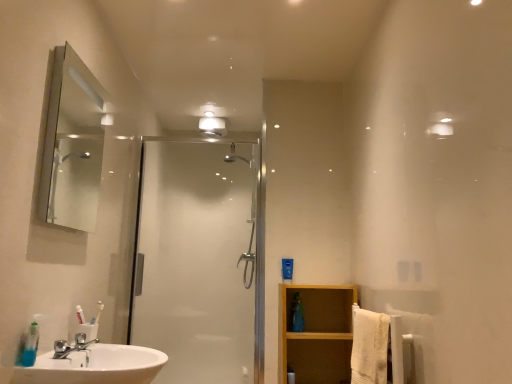
The width and height of the screenshot is (512, 384). What do you see at coordinates (317, 333) in the screenshot?
I see `wooden shelf at lower right` at bounding box center [317, 333].

Where is `white textured towel at right`? white textured towel at right is located at coordinates (369, 347).

Measure the distance between point (211,117) and camera.

They are 3.16 meters apart.

In order to click on clear glass shower door at center in this screenshot , I will do `click(196, 260)`.

Who is taller, wooden shelf at lower right or matte silver mirror at upper left?

With more height is matte silver mirror at upper left.

From the image's perspective, does wooden shelf at lower right appear lower than matte silver mirror at upper left?

Yes, from the image's perspective, wooden shelf at lower right is below matte silver mirror at upper left.

In the image, is wooden shelf at lower right on the left side or the right side of matte silver mirror at upper left?

Clearly, wooden shelf at lower right is on the right of matte silver mirror at upper left in the image.

Considering the sizes of objects wooden shelf at lower right and matte silver mirror at upper left in the image provided, who is wider, wooden shelf at lower right or matte silver mirror at upper left?

wooden shelf at lower right is wider.

This screenshot has width=512, height=384. I want to click on mirror above the clear glass shower door at center (from the image's perspective), so click(72, 145).

Considering the sizes of matte silver mirror at upper left and clear glass shower door at center in the image, is matte silver mirror at upper left bigger or smaller than clear glass shower door at center?

In the image, matte silver mirror at upper left appears to be smaller than clear glass shower door at center.

In the scene shown: Choose the correct answer: Is matte silver mirror at upper left inside clear glass shower door at center or outside it?

matte silver mirror at upper left is located beyond the bounds of clear glass shower door at center.

Considering the relative sizes of matte silver mirror at upper left and clear glass shower door at center in the image provided, is matte silver mirror at upper left shorter than clear glass shower door at center?

Yes, matte silver mirror at upper left is shorter than clear glass shower door at center.

Does point (319, 371) lie behind point (189, 264)?

No, it is in front of (189, 264).

Based on the photo, considering the relative sizes of wooden shelf at lower right and clear glass shower door at center in the image provided, is wooden shelf at lower right shorter than clear glass shower door at center?

Yes, wooden shelf at lower right is shorter than clear glass shower door at center.

Based on the photo, would you say wooden shelf at lower right is to the left or to the right of clear glass shower door at center in the picture?

wooden shelf at lower right is to the right of clear glass shower door at center.

Is wooden shelf at lower right placed right next to white textured towel at right?

No, wooden shelf at lower right is not touching white textured towel at right.

In order to click on bath towel located above the wooden shelf at lower right (from a real-world perspective) in this screenshot , I will do `click(369, 347)`.

Does white textured towel at right have a lesser width compared to wooden shelf at lower right?

Indeed, white textured towel at right has a lesser width compared to wooden shelf at lower right.

Does white textured towel at right have a lesser height compared to wooden shelf at lower right?

Correct, white textured towel at right is not as tall as wooden shelf at lower right.

Is white textured towel at right positioned with its back to wooden shelf at lower right?

white textured towel at right is not turned away from wooden shelf at lower right.

How many degrees apart are the facing directions of white textured towel at right and wooden shelf at lower right?

87.5 degrees.

At what (x,y) coordinates should I click in order to perform the action: click on light fixture that appears above the wooden shelf at lower right (from the image's perspective). Please return your answer as a coordinate pair (x, y). Image resolution: width=512 pixels, height=384 pixels. Looking at the image, I should click on (212, 125).

Considering the sizes of wooden shelf at lower right and white glossy light fixture at upper center in the image, is wooden shelf at lower right taller or shorter than white glossy light fixture at upper center?

Clearly, wooden shelf at lower right is taller compared to white glossy light fixture at upper center.

Is wooden shelf at lower right oriented away from white glossy light fixture at upper center?

No, wooden shelf at lower right is not facing the opposite direction of white glossy light fixture at upper center.

Is wooden shelf at lower right at the left side of white glossy light fixture at upper center?

No, wooden shelf at lower right is not to the left of white glossy light fixture at upper center.

Looking at this image, from the image's perspective, is matte silver mirror at upper left positioned above or below white textured towel at right?

Clearly, from the image's perspective, matte silver mirror at upper left is above white textured towel at right.

Is matte silver mirror at upper left oriented towards white textured towel at right?

Yes, matte silver mirror at upper left faces towards white textured towel at right.

Consider the image. Considering the relative positions of matte silver mirror at upper left and white textured towel at right in the image provided, is matte silver mirror at upper left to the left of white textured towel at right from the viewer's perspective?

Yes, matte silver mirror at upper left is to the left of white textured towel at right.

Is matte silver mirror at upper left spatially inside white textured towel at right, or outside of it?

The correct answer is: outside.

At what (x,y) coordinates should I click in order to perform the action: click on bathroom cabinet beneath the matte silver mirror at upper left (from a real-world perspective). Please return your answer as a coordinate pair (x, y). Looking at the image, I should click on (317, 333).

The width and height of the screenshot is (512, 384). What are the coordinates of `mirror in front of the clear glass shower door at center` in the screenshot? It's located at tap(72, 145).

Looking at the image, which one is located closer to clear glass shower door at center, wooden shelf at lower right or white textured towel at right?

Among the two, wooden shelf at lower right is located nearer to clear glass shower door at center.

Which object lies nearer to the anchor point white glossy light fixture at upper center, white textured towel at right or wooden shelf at lower right?

wooden shelf at lower right.

When comparing their distances from white textured towel at right, does matte silver mirror at upper left or wooden shelf at lower right seem further?

matte silver mirror at upper left.

Based on their spatial positions, is wooden shelf at lower right or matte silver mirror at upper left closer to clear glass shower door at center?

wooden shelf at lower right is positioned closer to the anchor clear glass shower door at center.

Based on their spatial positions, is wooden shelf at lower right or white glossy light fixture at upper center closer to matte silver mirror at upper left?

white glossy light fixture at upper center lies closer to matte silver mirror at upper left than the other object.

From the image, which object appears to be farther from white textured towel at right, white glossy light fixture at upper center or matte silver mirror at upper left?

matte silver mirror at upper left.

Estimate the real-world distances between objects in this image. Which object is closer to white glossy light fixture at upper center, wooden shelf at lower right or clear glass shower door at center?

clear glass shower door at center is closer to white glossy light fixture at upper center.

When comparing their distances from white textured towel at right, does wooden shelf at lower right or matte silver mirror at upper left seem further?

Based on the image, matte silver mirror at upper left appears to be further to white textured towel at right.

Locate an element on the screen. Image resolution: width=512 pixels, height=384 pixels. screen door between matte silver mirror at upper left and white glossy light fixture at upper center along the z-axis is located at coordinates (196, 260).

In order to click on bathroom cabinet between white textured towel at right and white glossy light fixture at upper center from front to back in this screenshot , I will do `click(317, 333)`.

Image resolution: width=512 pixels, height=384 pixels. I want to click on bathroom cabinet between matte silver mirror at upper left and white glossy light fixture at upper center from front to back, so (317, 333).

The image size is (512, 384). Identify the location of screen door between matte silver mirror at upper left and wooden shelf at lower right. (196, 260).